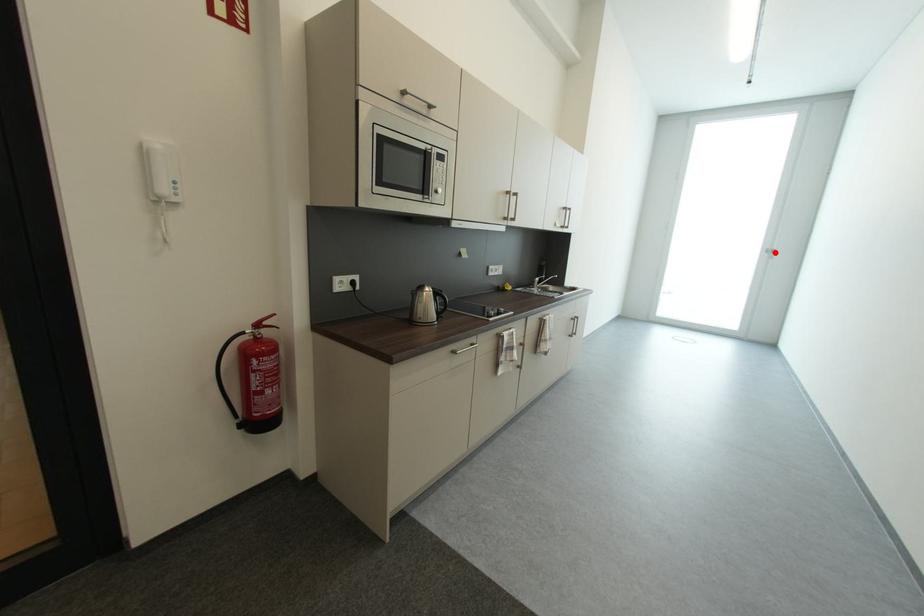
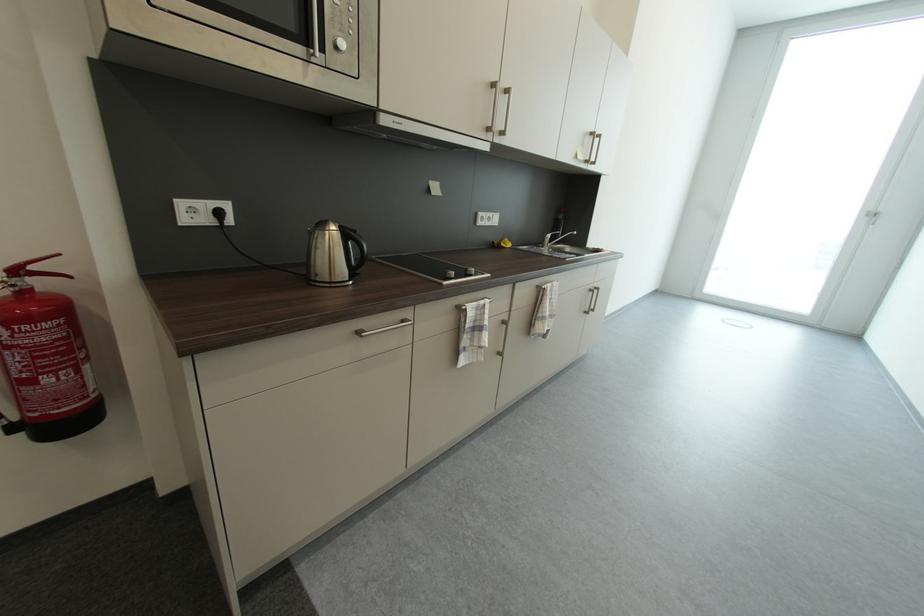
Question: I am providing you with two images of the same scene from different viewpoints. A red point is shown in image1. For the corresponding object point in image2, is it positioned nearer or farther from the camera?

Choices:
 (A) Nearer
 (B) Farther

Answer: (B)